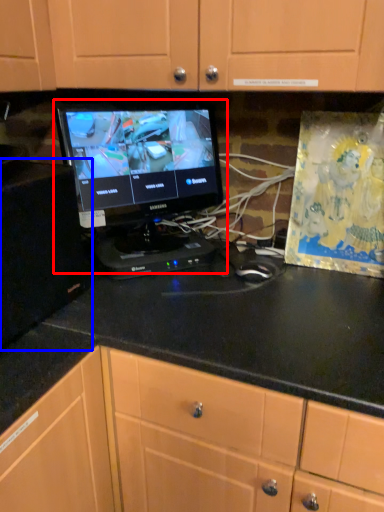
Question: Among these objects, which one is farthest to the camera, computer monitor (highlighted by a red box) or cabinetry (highlighted by a blue box)?

Choices:
 (A) computer monitor
 (B) cabinetry

Answer: (A)